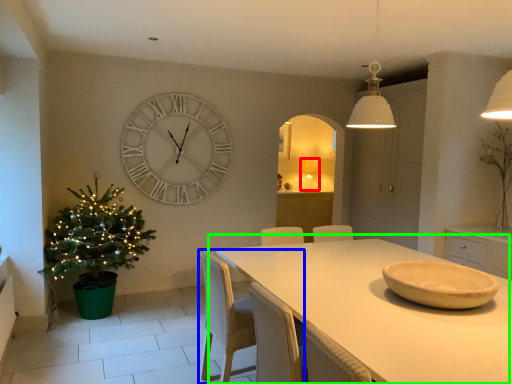
Question: Which is farther away from lamp (highlighted by a red box)? chair (highlighted by a blue box) or table (highlighted by a green box)?

Choices:
 (A) chair
 (B) table

Answer: (A)